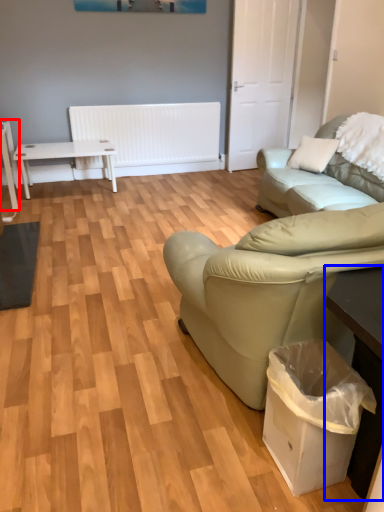
Question: Which object appears farthest to the camera in this image, table (highlighted by a red box) or table (highlighted by a blue box)?

Choices:
 (A) table
 (B) table

Answer: (A)